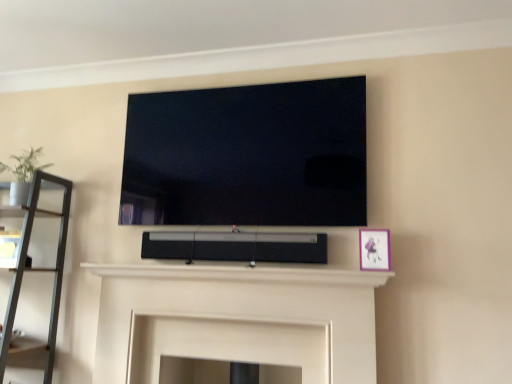
Where is `matte black shelf at left`? matte black shelf at left is located at coordinates (42, 269).

In order to click on green matte plant at left in this screenshot , I will do `click(24, 165)`.

What is the approximate width of matte pink picture frame at right?

matte pink picture frame at right is 4.12 inches in width.

Where is `flat screen tv at upper center`? This screenshot has height=384, width=512. flat screen tv at upper center is located at coordinates (247, 155).

The width and height of the screenshot is (512, 384). Identify the location of matte black shelf at left. (42, 269).

Is matte black shelf at left to the left of green matte plant at left from the viewer's perspective?

Yes, matte black shelf at left is to the left of green matte plant at left.

Considering the relative positions of matte black shelf at left and green matte plant at left in the image provided, is matte black shelf at left in front of green matte plant at left?

Yes, matte black shelf at left is in front of green matte plant at left.

From the image's perspective, is matte black shelf at left above green matte plant at left?

No, from the image's perspective, matte black shelf at left is not above green matte plant at left.

Between green matte plant at left and flat screen tv at upper center, which one has more height?

flat screen tv at upper center is taller.

Is green matte plant at left next to flat screen tv at upper center?

No.

In the scene shown: From a real-world perspective, between green matte plant at left and flat screen tv at upper center, who is vertically lower?

From a 3D spatial view, green matte plant at left is below.

From a real-world perspective, between black matte speaker at center and matte pink picture frame at right, who is vertically lower?

In real-world perspective, black matte speaker at center is lower.

Does black matte speaker at center have a lesser height compared to matte pink picture frame at right?

Correct, black matte speaker at center is not as tall as matte pink picture frame at right.

Considering the positions of objects black matte speaker at center and matte pink picture frame at right in the image provided, who is more to the right, black matte speaker at center or matte pink picture frame at right?

matte pink picture frame at right.

Could you tell me if matte pink picture frame at right is facing green matte plant at left?

No, matte pink picture frame at right is not facing towards green matte plant at left.

From the image's perspective, which is below, matte pink picture frame at right or green matte plant at left?

From the image's view, matte pink picture frame at right is below.

Is matte pink picture frame at right positioned far away from green matte plant at left?

matte pink picture frame at right is far away from green matte plant at left.

Is green matte plant at left completely or partially outside of black matte speaker at center?

Yes, green matte plant at left is outside of black matte speaker at center.

From the picture: Is green matte plant at left further to the viewer compared to black matte speaker at center?

Yes, it is.

In the scene shown: Which is nearer, (x=29, y=156) or (x=167, y=256)?

The point (x=167, y=256) is closer.

Locate an element on the screen. speaker above the matte black shelf at left (from a real-world perspective) is located at coordinates (236, 247).

Which of these two, black matte speaker at center or matte black shelf at left, is smaller?

With smaller size is black matte speaker at center.

Looking at this image, does black matte speaker at center come behind matte black shelf at left?

Yes, the depth of black matte speaker at center is greater than that of matte black shelf at left.

Does flat screen tv at upper center have a smaller size compared to matte pink picture frame at right?

Incorrect, flat screen tv at upper center is not smaller in size than matte pink picture frame at right.

From the picture: From a real-world perspective, is flat screen tv at upper center positioned above or below matte pink picture frame at right?

flat screen tv at upper center is above matte pink picture frame at right.

Which is behind, flat screen tv at upper center or matte pink picture frame at right?

A: flat screen tv at upper center is more distant.

The image size is (512, 384). Find the location of `shelf that appears in front of the green matte plant at left`. shelf that appears in front of the green matte plant at left is located at coordinates (42, 269).

What are the coordinates of `television above the green matte plant at left (from a real-world perspective)` in the screenshot? It's located at (247, 155).

In the scene shown: Estimate the real-world distances between objects in this image. Which object is further from white matte fireplace at center, green matte plant at left or matte black shelf at left?

green matte plant at left is further to white matte fireplace at center.

Looking at the image, which one is located closer to matte pink picture frame at right, matte black shelf at left or white matte fireplace at center?

Based on the image, white matte fireplace at center appears to be nearer to matte pink picture frame at right.

Based on their spatial positions, is matte pink picture frame at right or white matte fireplace at center further from flat screen tv at upper center?

Based on the image, matte pink picture frame at right appears to be further to flat screen tv at upper center.

Based on their spatial positions, is flat screen tv at upper center or matte black shelf at left closer to white matte fireplace at center?

Based on the image, flat screen tv at upper center appears to be nearer to white matte fireplace at center.

Estimate the real-world distances between objects in this image. Which object is further from matte pink picture frame at right, black matte speaker at center or flat screen tv at upper center?

flat screen tv at upper center is further to matte pink picture frame at right.

Looking at the image, which one is located further to matte pink picture frame at right, matte black shelf at left or green matte plant at left?

Among the two, green matte plant at left is located further to matte pink picture frame at right.

Looking at the image, which one is located further to matte pink picture frame at right, green matte plant at left or white matte fireplace at center?

green matte plant at left lies further to matte pink picture frame at right than the other object.

Based on their spatial positions, is green matte plant at left or matte black shelf at left closer to black matte speaker at center?

matte black shelf at left is closer to black matte speaker at center.

Locate an element on the screen. The height and width of the screenshot is (384, 512). picture frame between flat screen tv at upper center and white matte fireplace at center in the vertical direction is located at coordinates pyautogui.click(x=374, y=249).

Locate an element on the screen. The width and height of the screenshot is (512, 384). speaker situated between matte black shelf at left and matte pink picture frame at right from left to right is located at coordinates (236, 247).

This screenshot has height=384, width=512. Identify the location of speaker situated between green matte plant at left and matte pink picture frame at right from left to right. (236, 247).

The width and height of the screenshot is (512, 384). In order to click on television located between black matte speaker at center and matte pink picture frame at right in the left-right direction in this screenshot , I will do `click(247, 155)`.